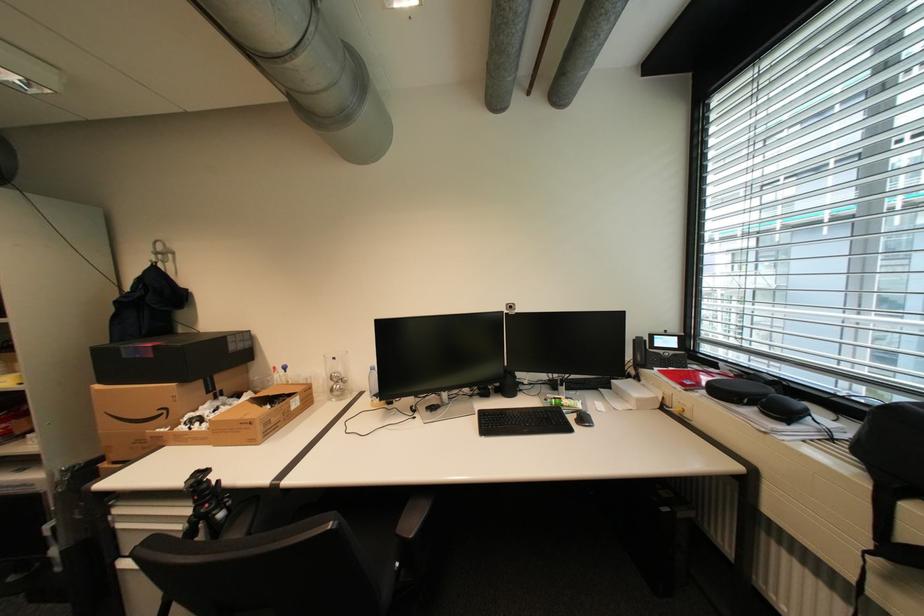
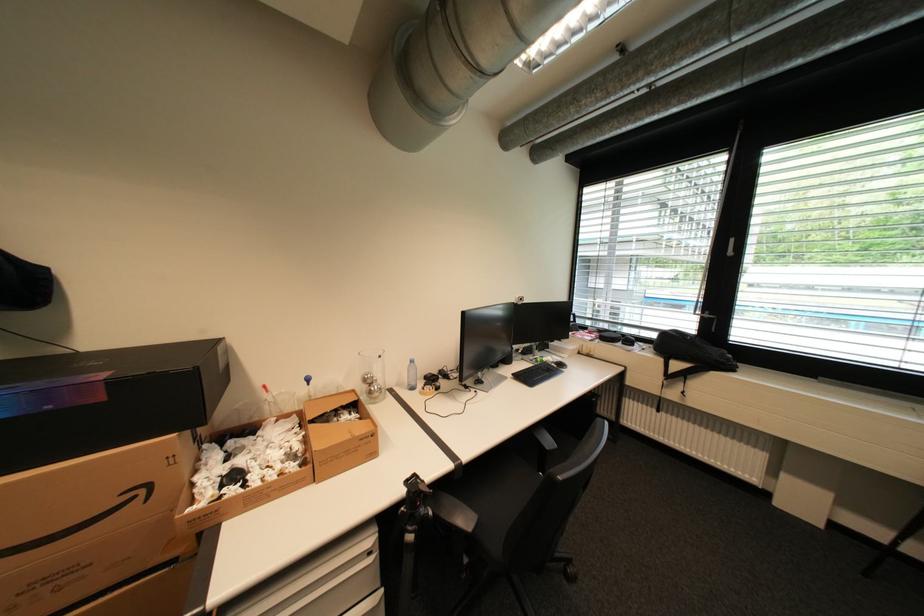
Where in the second image is the point corresponding to point 249,424 from the first image?

(370, 440)